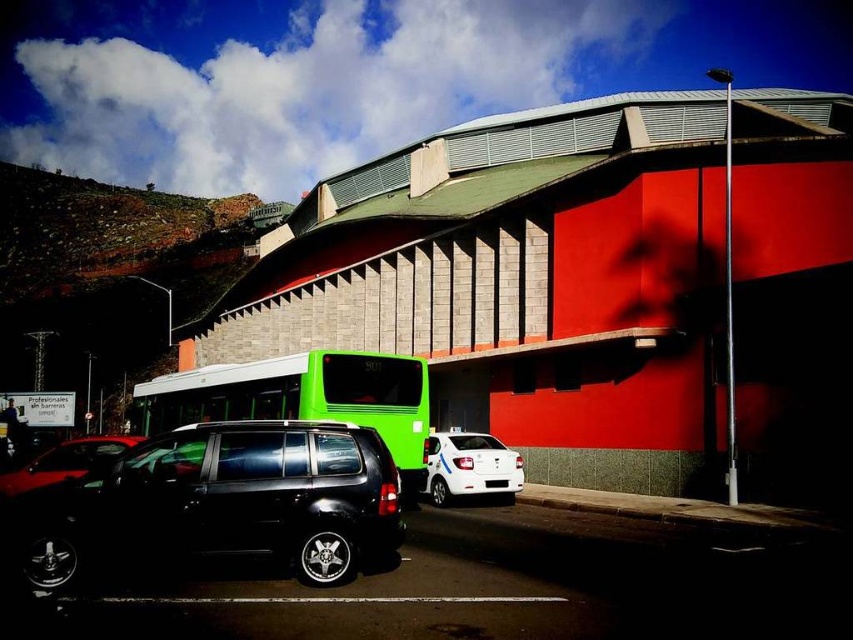
Question: Among these objects, which one is farthest from the camera?

Choices:
 (A) glossy black suv at center
 (B) green matte bus at center
 (C) shiny black car at lower left

Answer: (B)

Question: Estimate the real-world distances between objects in this image. Which object is closer to the shiny black car at lower left?

Choices:
 (A) glossy black suv at center
 (B) white glossy car at center
 (C) green matte bus at center
 (D) white plastic license plate at center

Answer: (A)

Question: Is glossy black suv at center to the left of shiny black car at lower left from the viewer's perspective?

Choices:
 (A) yes
 (B) no

Answer: (B)

Question: Is the position of white glossy car at center less distant than that of shiny black car at lower left?

Choices:
 (A) no
 (B) yes

Answer: (A)

Question: Which object appears closest to the camera in this image?

Choices:
 (A) shiny black car at lower left
 (B) green matte bus at center
 (C) white plastic license plate at center

Answer: (A)

Question: Is green matte bus at center in front of white glossy car at center?

Choices:
 (A) no
 (B) yes

Answer: (B)